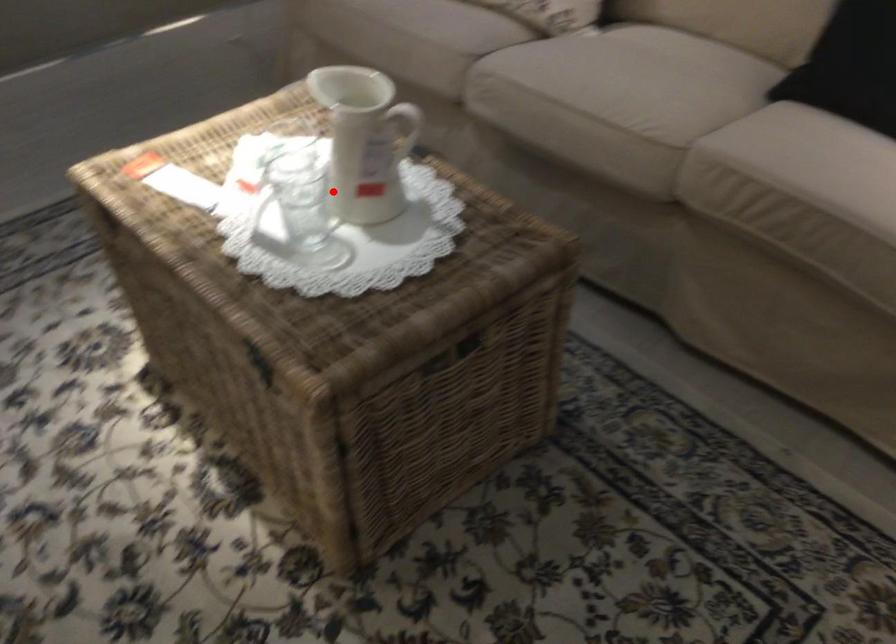
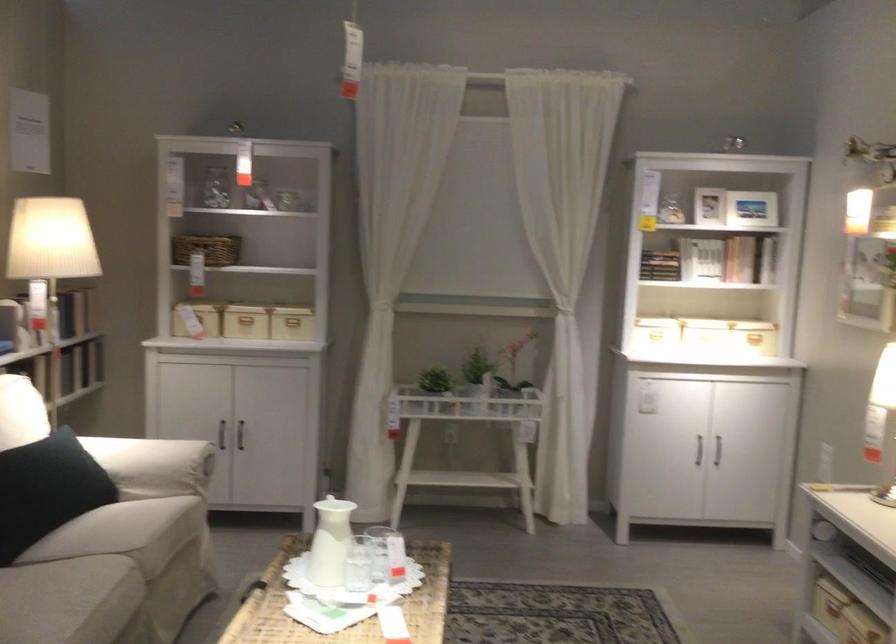
Where in the second image is the point corresponding to the highlighted location from the first image?

(358, 564)